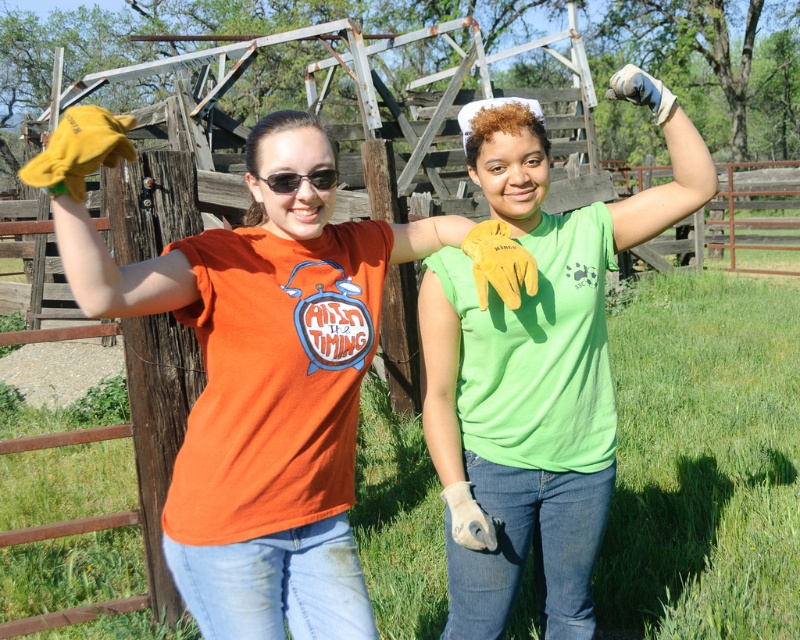
Question: Based on their relative distances, which object is farther from the matte orange t-shirt at left?

Choices:
 (A) green matte shirt at upper center
 (B) matte black sunglasses at upper center
 (C) yellow leather glove at center

Answer: (A)

Question: Which point is closer to the camera?

Choices:
 (A) (694, 188)
 (B) (450, 372)
 (C) (516, 304)
 (D) (462, 525)

Answer: (C)

Question: Which point is closer to the camera?

Choices:
 (A) matte black sunglasses at upper center
 (B) yellow leather glove at center
 (C) tan leather glove at center

Answer: (A)

Question: Is matte orange t-shirt at left in front of matte black sunglasses at upper center?

Choices:
 (A) no
 (B) yes

Answer: (B)

Question: Is tan leather glove at center smaller than light brown leather glove at lower center?

Choices:
 (A) no
 (B) yes

Answer: (A)

Question: Can you confirm if matte orange t-shirt at left is positioned above light brown leather glove at lower center?

Choices:
 (A) yes
 (B) no

Answer: (A)